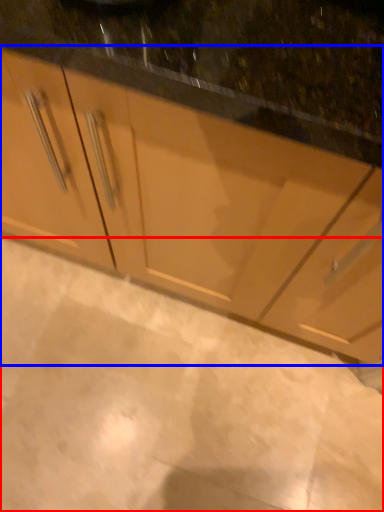
Question: Which of the following is the farthest to the observer, granite (highlighted by a red box) or cabinetry (highlighted by a blue box)?

Choices:
 (A) granite
 (B) cabinetry

Answer: (A)